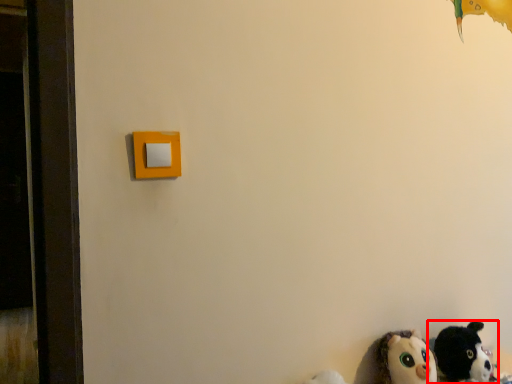
Question: In this image, where is toy (annotated by the red box) located relative to toy?

Choices:
 (A) right
 (B) left

Answer: (A)